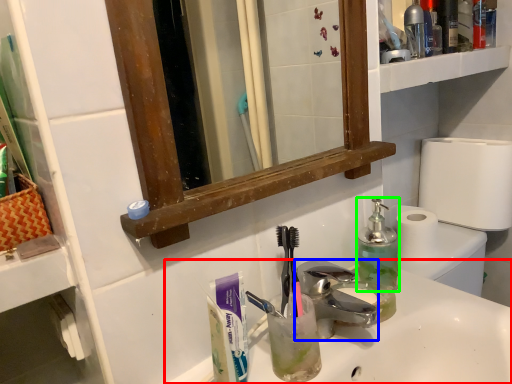
Question: Which object is positioned farthest from sink (highlighted by a red box)? Select from faucet (highlighted by a blue box) and bottle (highlighted by a green box).

Choices:
 (A) faucet
 (B) bottle

Answer: (B)